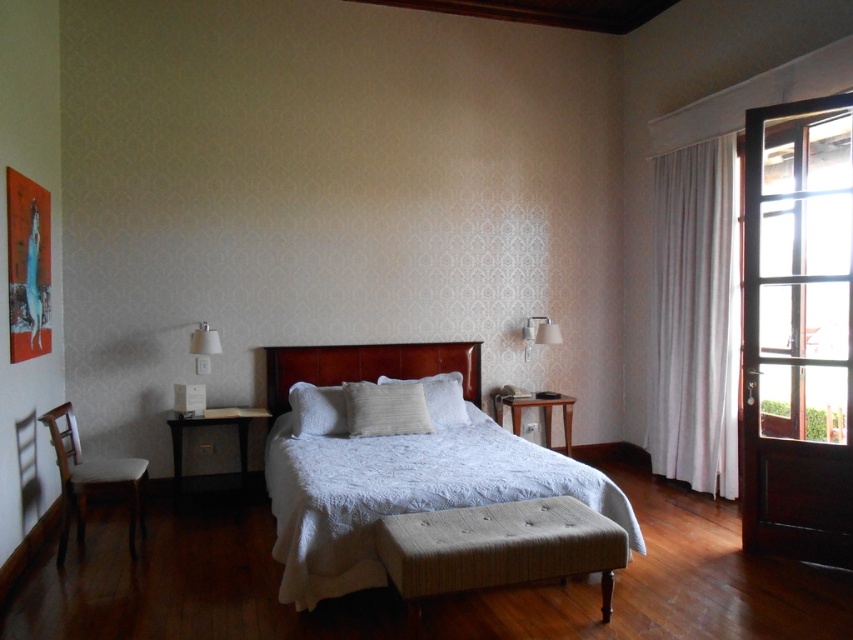
Between white sheer curtain at right and wooden headboard at center, which one appears on the right side from the viewer's perspective?

From the viewer's perspective, white sheer curtain at right appears more on the right side.

Who is higher up, white sheer curtain at right or wooden headboard at center?

white sheer curtain at right

Between point (693, 205) and point (268, 394), which one is positioned in front?

Point (693, 205) is more forward.

Image resolution: width=853 pixels, height=640 pixels. Identify the location of white sheer curtain at right. (695, 317).

Is point (790, 504) positioned behind point (461, 406)?

No.

The height and width of the screenshot is (640, 853). Describe the element at coordinates (798, 330) in the screenshot. I see `transparent glass door at right` at that location.

Where is `transparent glass door at right`? The height and width of the screenshot is (640, 853). transparent glass door at right is located at coordinates (798, 330).

Does point (309, 573) come farther from viewer compared to point (61, 468)?

No, it is not.

Between white textured bed at center and light brown wooden chair at lower left, which one appears on the right side from the viewer's perspective?

Positioned to the right is white textured bed at center.

Is point (384, 355) closer to camera compared to point (48, 417)?

No, it is not.

This screenshot has width=853, height=640. I want to click on white textured bed at center, so click(393, 468).